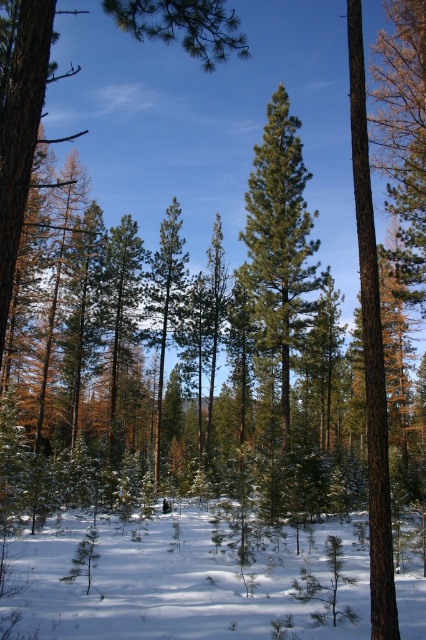
You are standing in a winter forest and see two points marked in the image. The first point is at coordinates point (45, 540) and the second is at point (305, 285). Which point is closer to you?

Point (45, 540) is closer to the camera than point (305, 285), so the first point is closer to you.